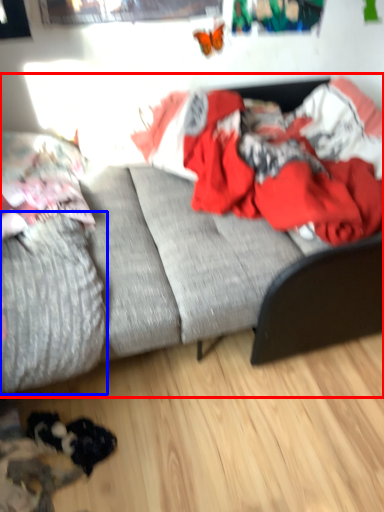
Question: Which point is further to the camera, studio couch (highlighted by a red box) or mattress (highlighted by a blue box)?

Choices:
 (A) studio couch
 (B) mattress

Answer: (B)